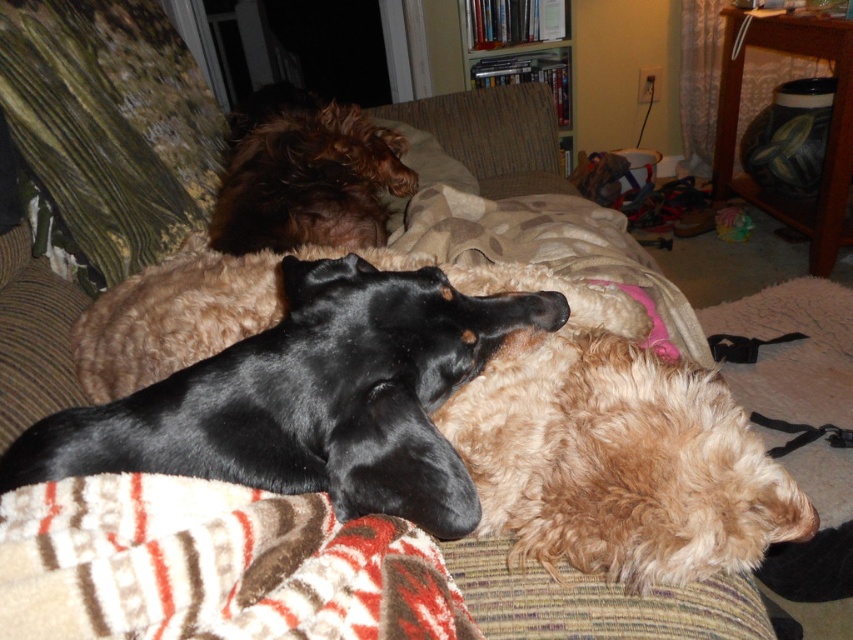
Is point (306, 337) in front of point (505, 488)?

Yes.

Does black smooth dog at center have a larger size compared to fuzzy brown dog at center?

No, black smooth dog at center is not bigger than fuzzy brown dog at center.

Does point (299, 308) come farther from viewer compared to point (734, 476)?

No, (299, 308) is closer to viewer.

Identify the location of black smooth dog at center. The height and width of the screenshot is (640, 853). (311, 397).

Which is behind, point (593, 541) or point (416, 140)?

The point (416, 140) is more distant.

Find the location of a particular element. Image resolution: width=853 pixels, height=640 pixels. fuzzy brown dog at center is located at coordinates (614, 448).

In order to click on fuzzy brown dog at center in this screenshot , I will do `click(614, 448)`.

Describe the element at coordinates (311, 397) in the screenshot. The image size is (853, 640). I see `black smooth dog at center` at that location.

At what (x,y) coordinates should I click in order to perform the action: click on black smooth dog at center. Please return your answer as a coordinate pair (x, y). Image resolution: width=853 pixels, height=640 pixels. Looking at the image, I should click on (311, 397).